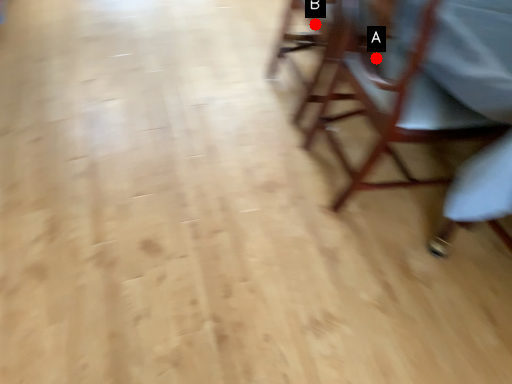
Question: Two points are circled on the image, labeled by A and B beside each circle. Which point appears closest to the camera in this image?

Choices:
 (A) A is closer
 (B) B is closer

Answer: (A)